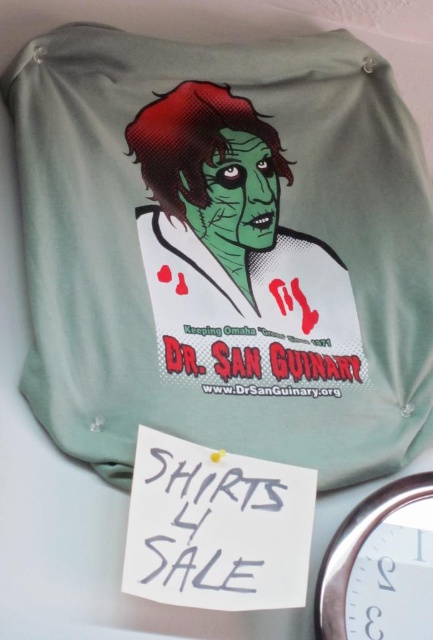
Does green matte/soft dr san guinary at center lie in front of white plastic clock at lower right?

No, green matte/soft dr san guinary at center is further to the viewer.

Is green matte/soft dr san guinary at center bigger than white plastic clock at lower right?

Correct, green matte/soft dr san guinary at center is larger in size than white plastic clock at lower right.

Locate an element on the screen. Image resolution: width=433 pixels, height=640 pixels. green matte/soft dr san guinary at center is located at coordinates (235, 253).

Where is `matte green fabric lab coat at center`? This screenshot has height=640, width=433. matte green fabric lab coat at center is located at coordinates point(223,250).

Can you confirm if matte green fabric lab coat at center is thinner than green matte/soft dr san guinary at center?

Incorrect, matte green fabric lab coat at center's width is not less than green matte/soft dr san guinary at center's.

Does point (374, 186) lie behind point (290, 312)?

No, it is not.

Identify the location of matte green fabric lab coat at center. (223, 250).

Measure the distance from matte green fabric lab coat at center to white plastic clock at lower right.

matte green fabric lab coat at center and white plastic clock at lower right are 18.91 inches apart from each other.

Between point (251, 81) and point (323, 621), which one is positioned behind?

Point (251, 81)

Where is `matte green fabric lab coat at center`? The width and height of the screenshot is (433, 640). matte green fabric lab coat at center is located at coordinates (223, 250).

Where is `matte green fabric lab coat at center`? matte green fabric lab coat at center is located at coordinates (223, 250).